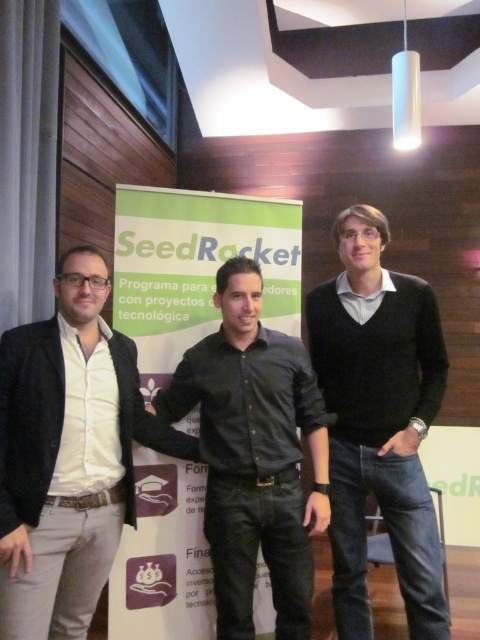
Question: In this image, where is black sweater at center located relative to black leather shirt at center?

Choices:
 (A) right
 (B) left

Answer: (A)

Question: Does white matte shirt at left have a larger size compared to black leather shirt at center?

Choices:
 (A) no
 (B) yes

Answer: (B)

Question: Which point is closer to the camera taking this photo?

Choices:
 (A) (292, 365)
 (B) (22, 454)
 (C) (336, 413)

Answer: (B)

Question: Considering the real-world distances, which object is farthest from the white matte shirt at left?

Choices:
 (A) black sweater at center
 (B) black leather shirt at center

Answer: (A)

Question: Which point is closer to the camera?

Choices:
 (A) (420, 627)
 (B) (38, 525)

Answer: (B)

Question: Does black sweater at center come behind black leather shirt at center?

Choices:
 (A) no
 (B) yes

Answer: (B)